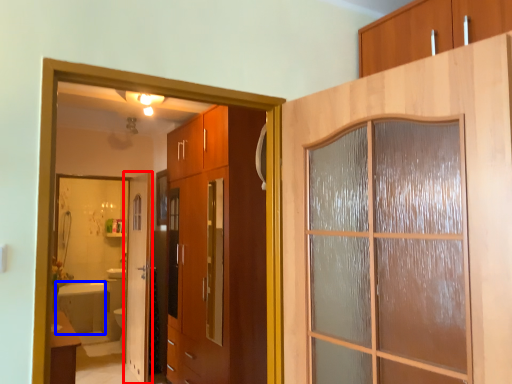
Question: Which point is closer to the camera, door (highlighted by a red box) or bath (highlighted by a blue box)?

Choices:
 (A) door
 (B) bath

Answer: (A)